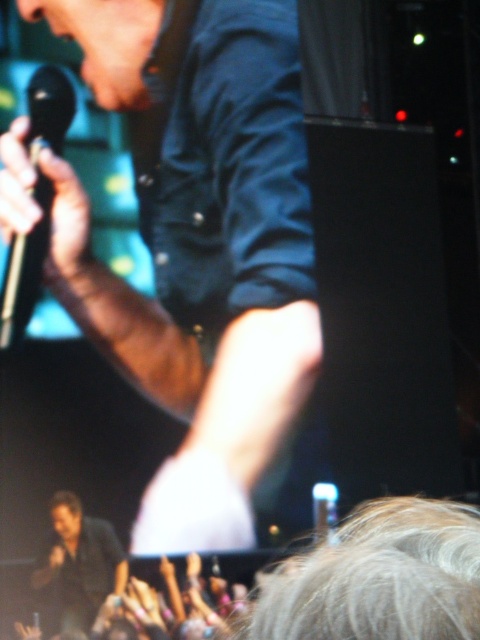
Question: Does matte black microphone at upper left appear on the left side of black metallic microphone at left?

Choices:
 (A) no
 (B) yes

Answer: (A)

Question: Which point is farther from the camera taking this photo?

Choices:
 (A) (48, 97)
 (B) (111, 545)

Answer: (A)

Question: Which point is closer to the camera?

Choices:
 (A) (48, 97)
 (B) (222, 189)
 (C) (105, 568)

Answer: (C)

Question: Does dark blue shirt at lower left have a smaller size compared to black metallic microphone at left?

Choices:
 (A) yes
 (B) no

Answer: (A)

Question: From the image, what is the correct spatial relationship of matte black microphone at upper left in relation to dark blue shirt at lower left?

Choices:
 (A) right
 (B) left

Answer: (A)

Question: Which point appears farthest from the camera in this image?

Choices:
 (A) (35, 573)
 (B) (267, 225)

Answer: (B)